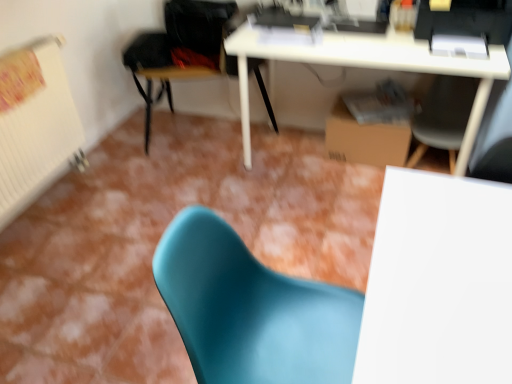
Find the location of `free space that is to the left of brown cardboard box at lower right`. free space that is to the left of brown cardboard box at lower right is located at coordinates (301, 162).